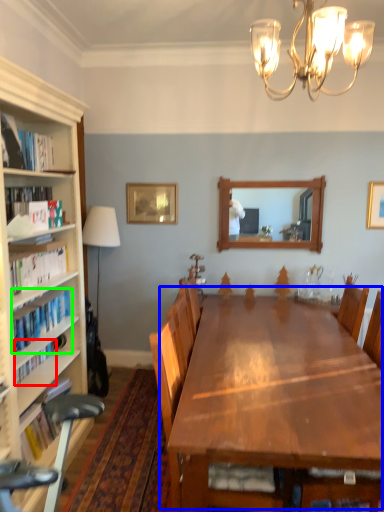
Question: Estimate the real-world distances between objects in this image. Which object is closer to book (highlighted by a red box), table (highlighted by a blue box) or book (highlighted by a green box)?

Choices:
 (A) table
 (B) book

Answer: (B)